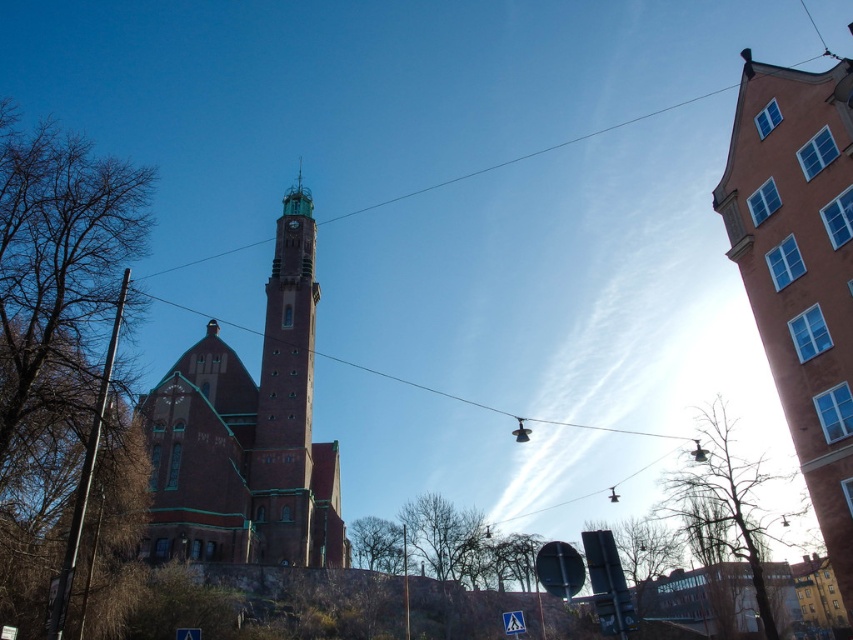
You are a tourist standing on the street looking at the scene. Which of the two churches, the terracotta brick church at upper right or the brick church at center, appears closer to you based on their positions in the image?

The terracotta brick church at upper right is positioned under the brick church at center, so the brick church at center appears closer to you because objects lower in the image are typically closer to the viewer.